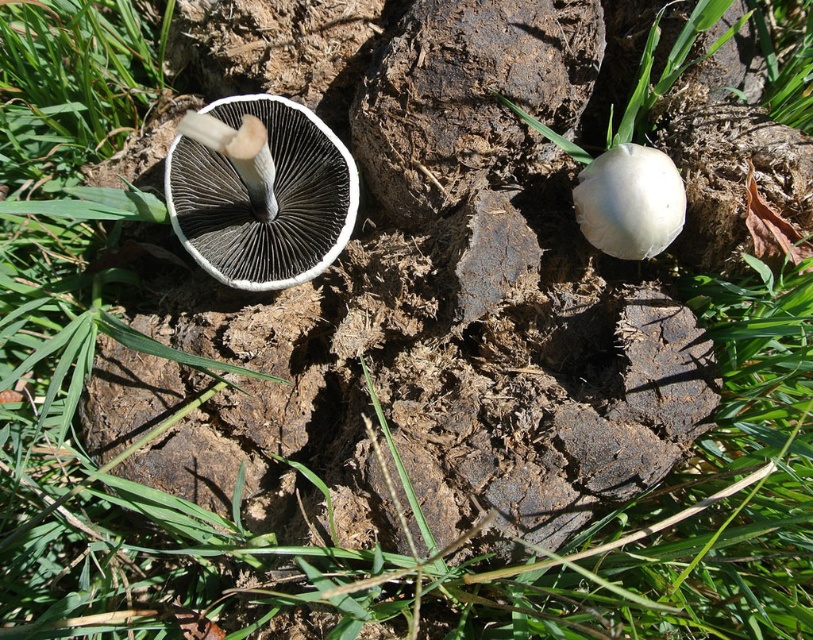
Question: Which object is closer to the camera taking this photo?

Choices:
 (A) white matte mushroom at right
 (B) white matte mushroom at center

Answer: (B)

Question: Does white matte mushroom at center have a greater width compared to white matte mushroom at right?

Choices:
 (A) no
 (B) yes

Answer: (B)

Question: Which of the following is the closest to the observer?

Choices:
 (A) (677, 188)
 (B) (288, 164)

Answer: (A)

Question: Can you confirm if white matte mushroom at center is thinner than white matte mushroom at right?

Choices:
 (A) no
 (B) yes

Answer: (A)

Question: Observing the image, what is the correct spatial positioning of white matte mushroom at center in reference to white matte mushroom at right?

Choices:
 (A) right
 (B) left

Answer: (B)